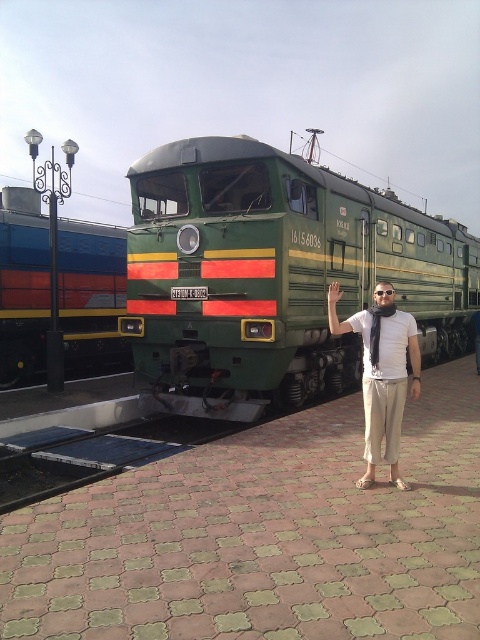
You are a passenger waiting on the platform and see the metallic green train at left and the matte white shirt at center. Which object is closer to your right side?

The matte white shirt at center is closer to your right side because the metallic green train at left is positioned to the left of it.

You are a passenger at the train station and you see the green matte train at center and the matte green scarf at center. Which object is positioned to the left?

The green matte train at center is to the left of the matte green scarf at center.